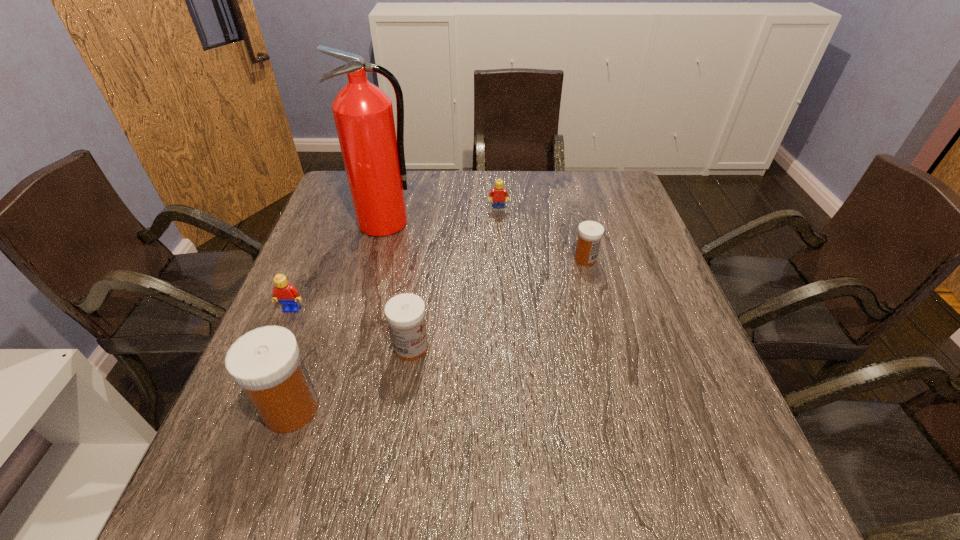
Identify which object is the nearest to the fifth farthest object. Please provide its 2D coordinates. Your answer should be formatted as a tuple, i.e. [(x, y)], where the tuple contains the x and y coordinates of a point satisfying the conditions above.

[(266, 362)]

The width and height of the screenshot is (960, 540). Find the location of `medicine that stands as the second closest to the rightmost medicine`. medicine that stands as the second closest to the rightmost medicine is located at coordinates (266, 362).

Find the location of a particular element. the closest medicine to the rightmost medicine is located at coordinates click(405, 313).

Locate an element on the screen. The height and width of the screenshot is (540, 960). free space that satisfies the following two spatial constraints: 1. on the front-facing side of the right Lego; 2. on the left side of the rightmost object is located at coordinates (501, 259).

Identify the location of blank area in the image that satisfies the following two spatial constraints: 1. on the front-facing side of the fifth object from left to right; 2. on the left side of the rightmost object. Image resolution: width=960 pixels, height=540 pixels. click(501, 259).

This screenshot has width=960, height=540. I want to click on vacant area that satisfies the following two spatial constraints: 1. at the nozzle of the fire extinguisher; 2. on the right side of the fourth nearest object, so click(375, 259).